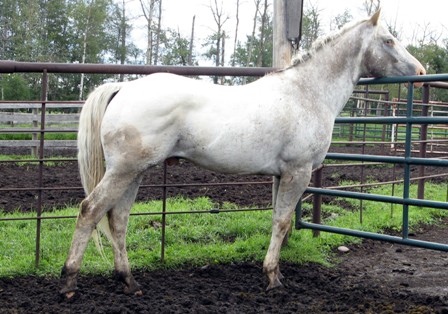
Image resolution: width=448 pixels, height=314 pixels. What are the coordinates of `frame` in the screenshot? It's located at click(x=162, y=221).